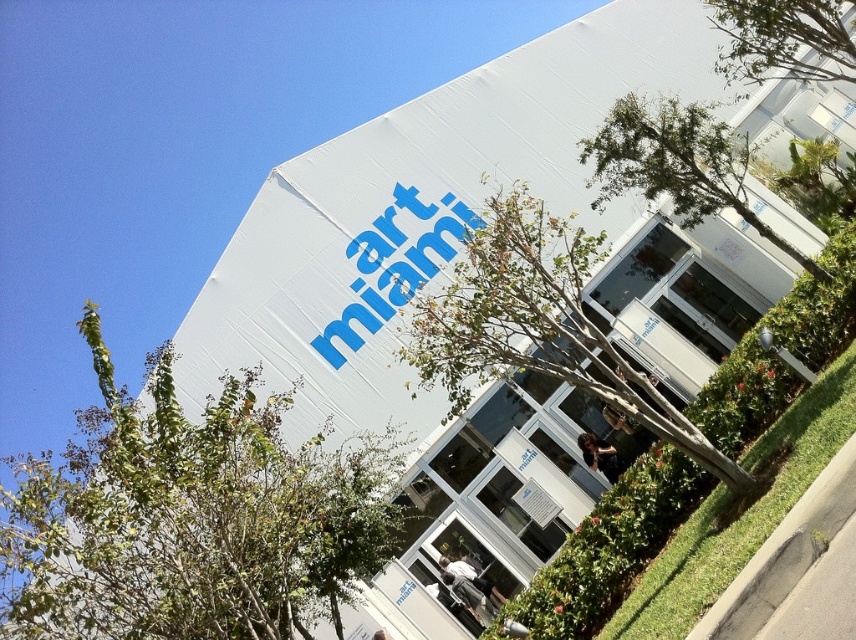
Question: Among these points, which one is farthest from the camera?

Choices:
 (A) (615, 392)
 (B) (733, 161)
 (C) (201, 493)

Answer: (B)

Question: Can you confirm if green leafy tree at upper left is positioned to the right of transparent glass door at center?

Choices:
 (A) no
 (B) yes

Answer: (A)

Question: Can you confirm if transparent glass door at center is positioned to the right of green leafy tree at upper right?

Choices:
 (A) no
 (B) yes

Answer: (A)

Question: Which of the following is the closest to the observer?

Choices:
 (A) (399, 518)
 (B) (771, 228)

Answer: (A)

Question: Is green leafy tree at center below green leafy tree at upper right?

Choices:
 (A) yes
 (B) no

Answer: (A)

Question: Which object is closer to the camera taking this photo?

Choices:
 (A) green leafy tree at upper left
 (B) transparent glass door at center
 (C) green leafy tree at upper right
 (D) green leafy tree at center

Answer: (A)